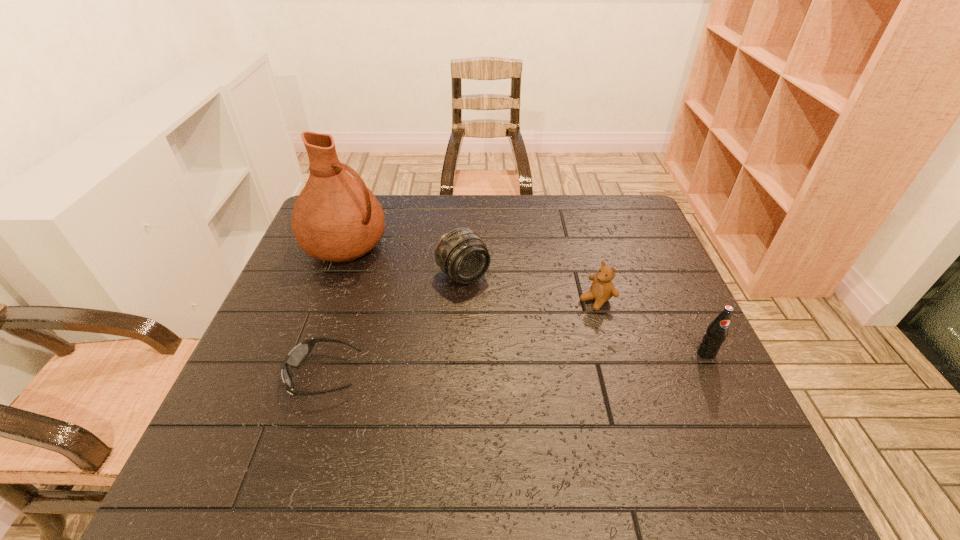
Where is `free spot between the pitcher and the sunglasses`? free spot between the pitcher and the sunglasses is located at coordinates (335, 310).

At what (x,y) coordinates should I click in order to perform the action: click on vacant area between the pop and the telephoto lens. Please return your answer as a coordinate pair (x, y). This screenshot has width=960, height=540. Looking at the image, I should click on (585, 314).

I want to click on free spot between the shortest object and the tallest object, so click(335, 310).

The width and height of the screenshot is (960, 540). Find the location of `unoccupied position between the telephoto lens and the fourth object from left to right`. unoccupied position between the telephoto lens and the fourth object from left to right is located at coordinates (530, 287).

Where is `free area in between the sunglasses and the rightmost object`? The width and height of the screenshot is (960, 540). free area in between the sunglasses and the rightmost object is located at coordinates (516, 364).

Identify which object is the third closest to the telephoto lens. Please provide its 2D coordinates. Your answer should be formatted as a tuple, i.e. [(x, y)], where the tuple contains the x and y coordinates of a point satisfying the conditions above.

[(298, 354)]

Locate which object ranks fourth in proximity to the telephoto lens. Please provide its 2D coordinates. Your answer should be formatted as a tuple, i.e. [(x, y)], where the tuple contains the x and y coordinates of a point satisfying the conditions above.

[(716, 332)]